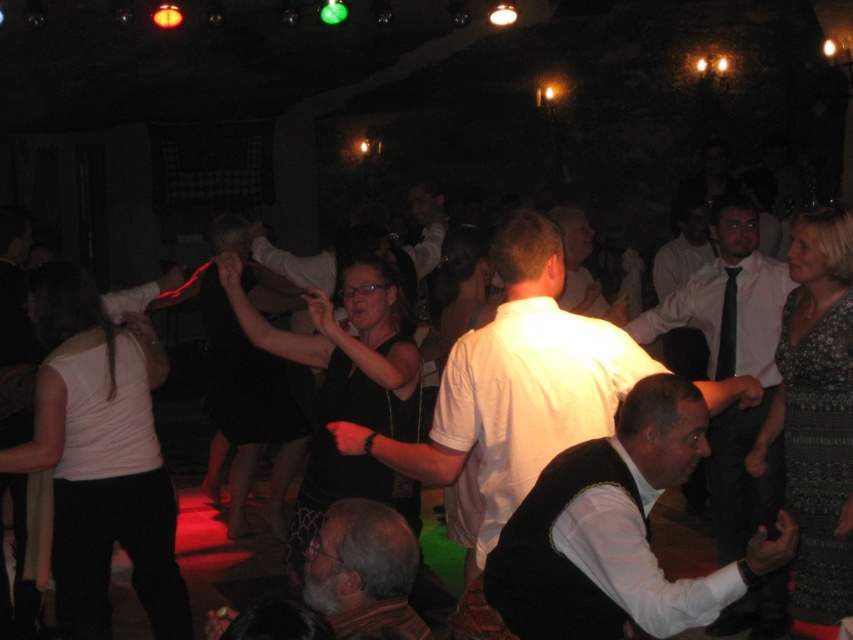
Is point (637, 339) positioned in front of point (318, 579)?

No, (637, 339) is behind (318, 579).

Does white shirt at center have a smaller size compared to gray hair at lower center?

No, white shirt at center is not smaller than gray hair at lower center.

What do you see at coordinates (735, 368) in the screenshot? I see `white shirt at center` at bounding box center [735, 368].

Identify the location of white shirt at center. This screenshot has width=853, height=640. (735, 368).

Can you confirm if gray hair at lower center is positioned to the right of black silk tie at center?

No, gray hair at lower center is not to the right of black silk tie at center.

Between gray hair at lower center and black silk tie at center, which one is positioned higher?

Positioned higher is black silk tie at center.

Who is more distant from viewer, [320,577] or [718,368]?

Positioned behind is point [718,368].

Find the location of `gray hair at lower center`. gray hair at lower center is located at coordinates click(363, 568).

Based on the photo, between white matte shirt at center and white shirt at center, which one has less height?

white matte shirt at center is shorter.

Measure the distance between point (628, 380) and camera.

Point (628, 380) is 3.13 meters from camera.

At what (x,y) coordinates should I click in order to perform the action: click on white matte shirt at center. Please return your answer as a coordinate pair (x, y). This screenshot has width=853, height=640. Looking at the image, I should click on click(x=515, y=385).